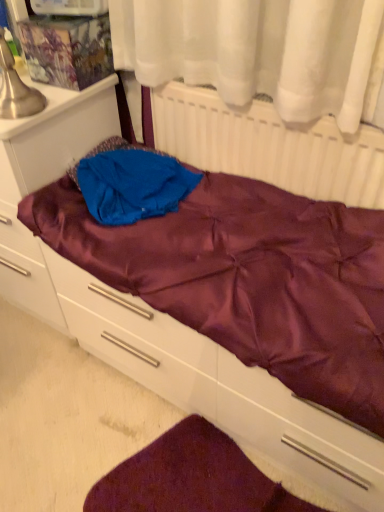
Question: Is white matte radiator at upper center with satin purple drawer at lower center?

Choices:
 (A) no
 (B) yes

Answer: (A)

Question: Is white matte radiator at upper center wider than satin purple drawer at lower center?

Choices:
 (A) no
 (B) yes

Answer: (A)

Question: From a real-world perspective, is white matte radiator at upper center located beneath satin purple drawer at lower center?

Choices:
 (A) no
 (B) yes

Answer: (A)

Question: Considering the relative positions of white matte radiator at upper center and satin purple drawer at lower center in the image provided, is white matte radiator at upper center in front of satin purple drawer at lower center?

Choices:
 (A) yes
 (B) no

Answer: (B)

Question: Is white matte radiator at upper center further to camera compared to satin purple drawer at lower center?

Choices:
 (A) yes
 (B) no

Answer: (A)

Question: From a real-world perspective, is white matte radiator at upper center located higher than satin purple drawer at lower center?

Choices:
 (A) yes
 (B) no

Answer: (A)

Question: Is satin purple file cabinet at left looking in the opposite direction of white matte radiator at upper center?

Choices:
 (A) yes
 (B) no

Answer: (B)

Question: Is satin purple file cabinet at left aimed at white matte radiator at upper center?

Choices:
 (A) yes
 (B) no

Answer: (B)

Question: Considering the relative positions of satin purple file cabinet at left and white matte radiator at upper center in the image provided, is satin purple file cabinet at left to the right of white matte radiator at upper center from the viewer's perspective?

Choices:
 (A) no
 (B) yes

Answer: (A)

Question: Is satin purple file cabinet at left at the left side of white matte radiator at upper center?

Choices:
 (A) no
 (B) yes

Answer: (B)

Question: Is satin purple file cabinet at left not within white matte radiator at upper center?

Choices:
 (A) yes
 (B) no

Answer: (A)

Question: From a real-world perspective, does satin purple file cabinet at left stand above white matte radiator at upper center?

Choices:
 (A) no
 (B) yes

Answer: (A)

Question: Would you say velvety maroon mat at lower center contains white matte radiator at upper center?

Choices:
 (A) no
 (B) yes

Answer: (A)